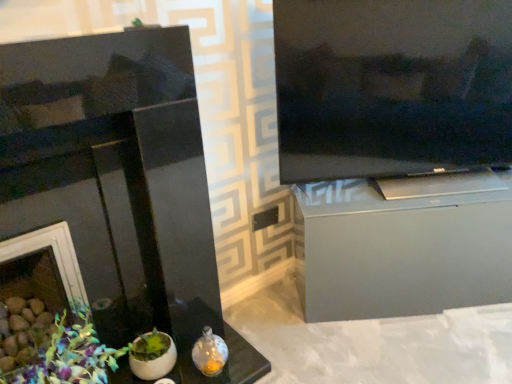
Question: Does point (480, 187) appear closer or farther from the camera than point (362, 119)?

Choices:
 (A) farther
 (B) closer

Answer: (A)

Question: In the image, is satin silver cabinet at right positioned in front of or behind black glossy television at upper right?

Choices:
 (A) behind
 (B) front

Answer: (A)

Question: Based on their relative distances, which object is nearer to the black glossy television at upper right?

Choices:
 (A) black glossy fireplace at left
 (B) matte green plant at lower left
 (C) satin silver cabinet at right

Answer: (C)

Question: Estimate the real-world distances between objects in this image. Which object is closer to the satin silver cabinet at right?

Choices:
 (A) black glossy fireplace at left
 (B) matte green plant at lower left
 (C) black glossy television at upper right

Answer: (C)